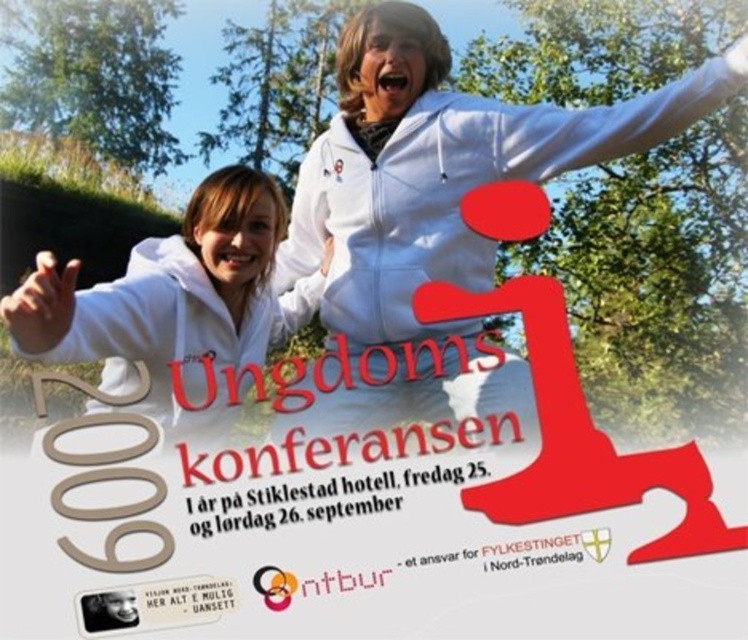
Is white zip-up hoodie at upper center shorter than white matte hoodie at center?

Incorrect, white zip-up hoodie at upper center's height does not fall short of white matte hoodie at center's.

Is white zip-up hoodie at upper center to the right of white matte hoodie at center from the viewer's perspective?

Indeed, white zip-up hoodie at upper center is positioned on the right side of white matte hoodie at center.

Is point (426, 80) positioned before point (212, 189)?

No, it is not.

Where is `white zip-up hoodie at upper center`? white zip-up hoodie at upper center is located at coordinates (441, 168).

Looking at this image, can you confirm if white matte hoodie at center is taller than white matte arm at upper left?

Yes, white matte hoodie at center is taller than white matte arm at upper left.

Is white matte hoodie at center thinner than white matte arm at upper left?

In fact, white matte hoodie at center might be wider than white matte arm at upper left.

In order to click on white matte hoodie at center in this screenshot , I will do `click(174, 294)`.

Identify the location of white matte hoodie at center. This screenshot has height=640, width=748. (174, 294).

Is white zip-up hoodie at upper center above white smooth arm at upper right?

Incorrect, white zip-up hoodie at upper center is not positioned above white smooth arm at upper right.

Does point (441, 56) come in front of point (699, 67)?

No, (441, 56) is behind (699, 67).

Identify the location of white zip-up hoodie at upper center. Image resolution: width=748 pixels, height=640 pixels. (441, 168).